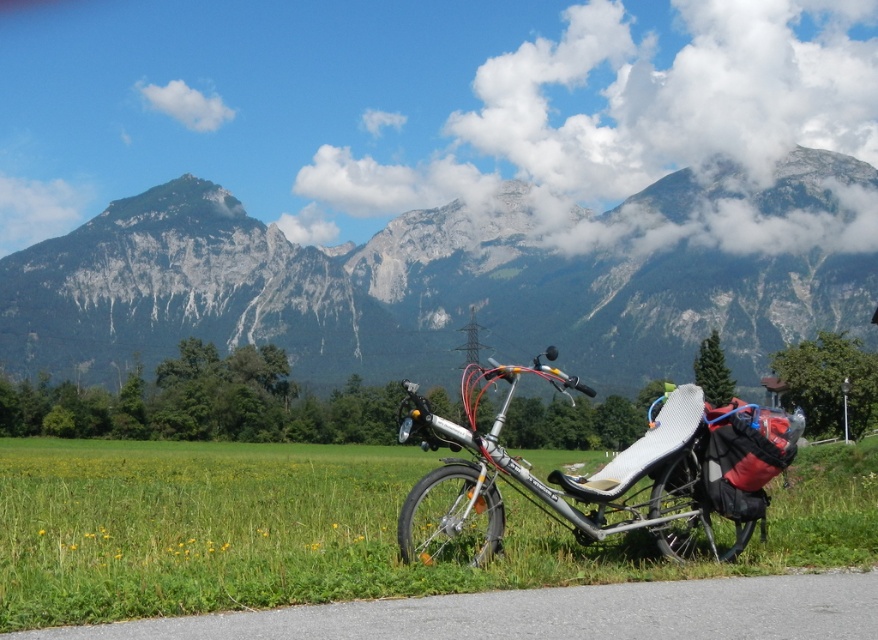
Question: Observing the image, what is the correct spatial positioning of rugged stone mountain at upper center in reference to green grass at lower center?

Choices:
 (A) above
 (B) below

Answer: (A)

Question: Which of the following is the farthest from the observer?

Choices:
 (A) green grass at lower center
 (B) rugged stone mountain at upper center

Answer: (B)

Question: Which point is farther to the camera?

Choices:
 (A) (700, 454)
 (B) (797, 204)

Answer: (B)

Question: Does rugged stone mountain at upper center come behind silver metallic reclining bicycle at center?

Choices:
 (A) yes
 (B) no

Answer: (A)

Question: Does green grass at lower center appear on the right side of silver metallic reclining bicycle at center?

Choices:
 (A) no
 (B) yes

Answer: (A)

Question: Which of the following is the farthest from the observer?

Choices:
 (A) rugged stone mountain at upper center
 (B) silver metallic reclining bicycle at center

Answer: (A)